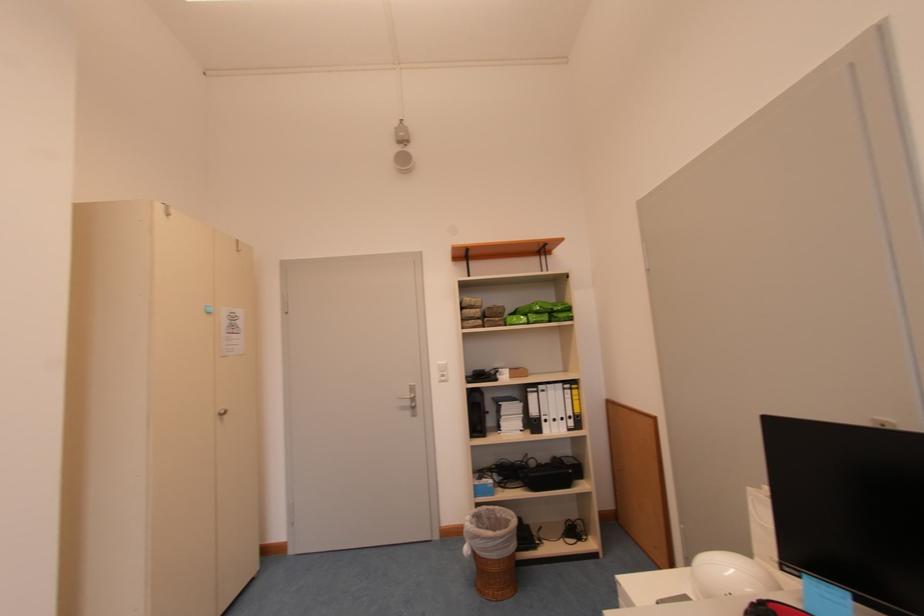
Find where to lift the black binder. Please return your answer as a coordinate pair (x, y).

(532, 410)